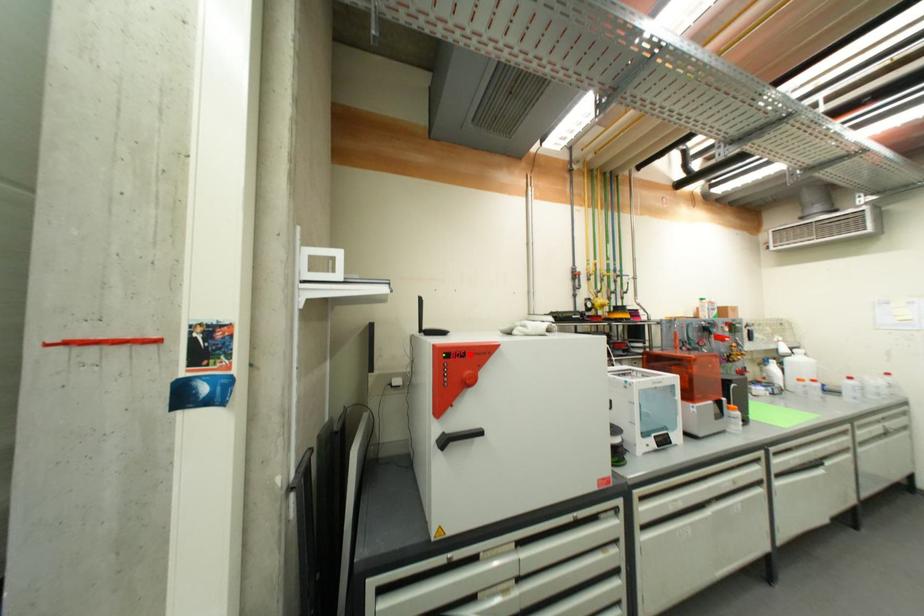
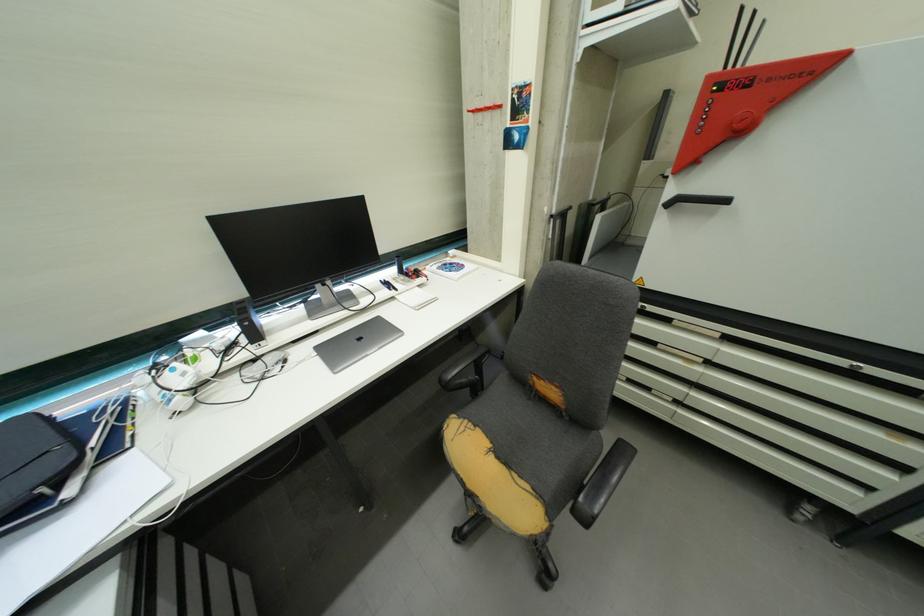
In the second image, find the point that corresponds to the highlighted location in the first image.

(759, 81)